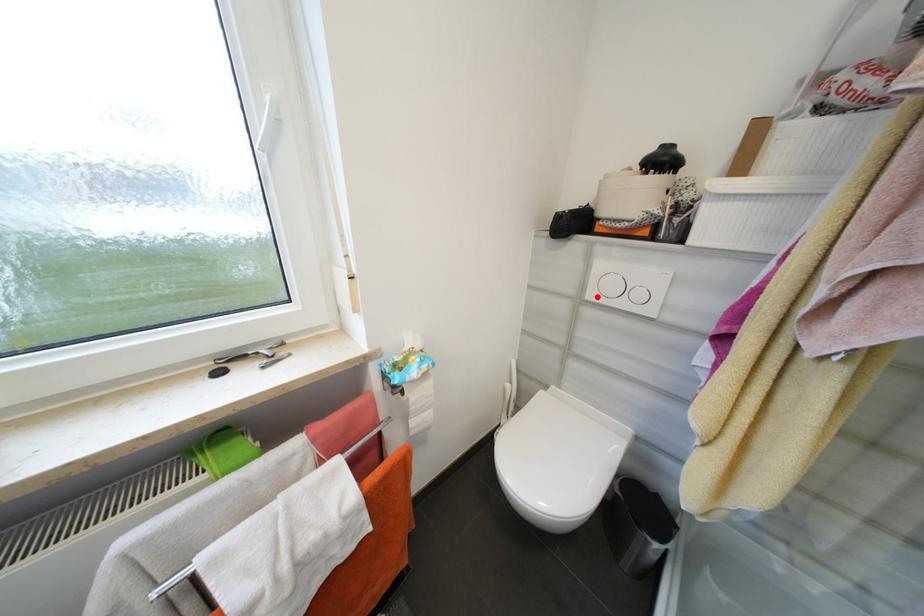
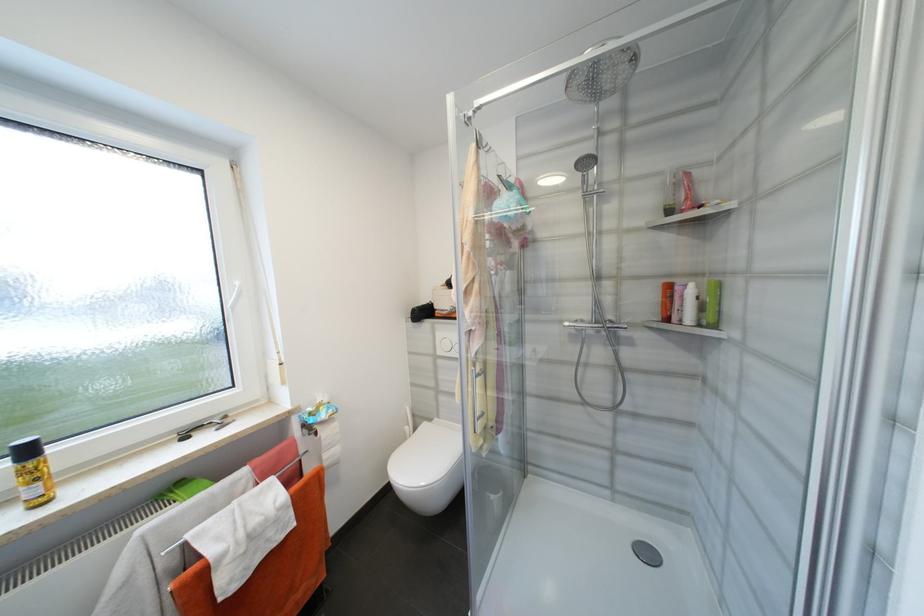
Find the pixel in the second image that matches the highlighted location in the first image.

(445, 353)